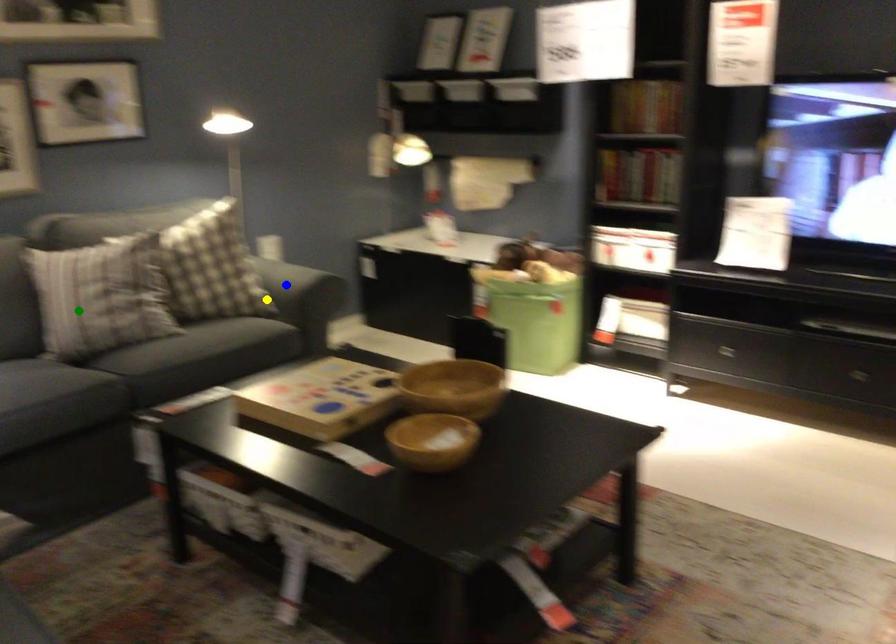
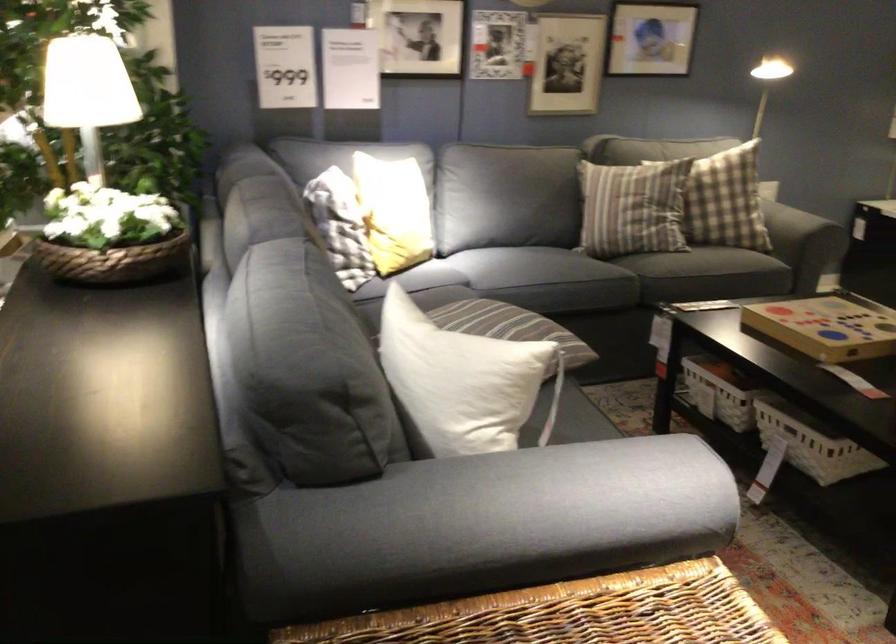
I am providing you with two images of the same scene from different viewpoints. Three points are marked in image1. Which point corresponds to a part or object that is occluded in image2?In image1, three points are marked. Which of them correspond to a part or object that is occluded in image2?Among the three points shown in image1, which one corresponds to a part or object that is no longer visible due to occlusion in image2?

blue point